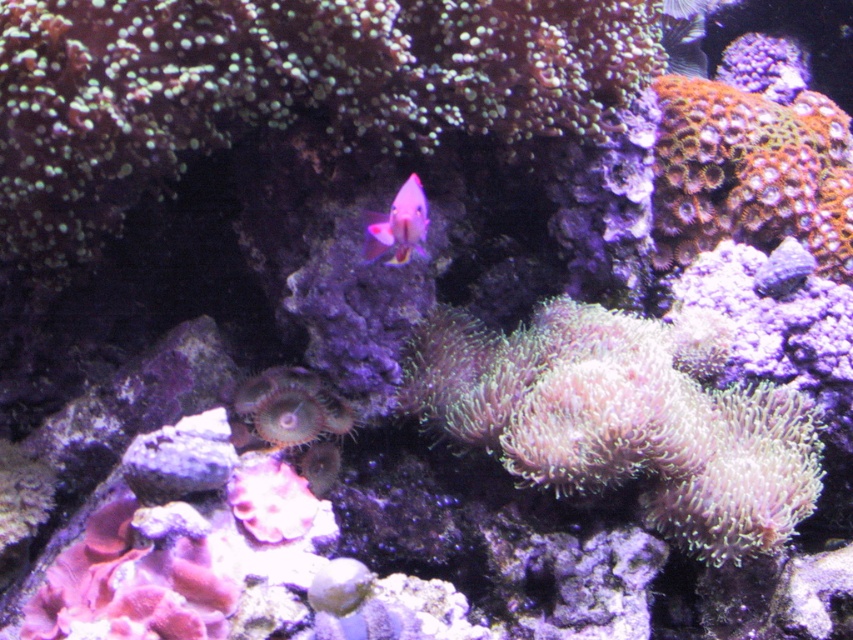
Question: Does green translucent coral at center appear under pink glossy fish at center?

Choices:
 (A) no
 (B) yes

Answer: (B)

Question: Is green translucent coral at center wider than purple coral at center?

Choices:
 (A) no
 (B) yes

Answer: (B)

Question: Estimate the real-world distances between objects in this image. Which object is closer to the green translucent coral at center?

Choices:
 (A) purple coral at center
 (B) pink glossy fish at center

Answer: (B)

Question: Which object is the farthest from the green translucent coral at center?

Choices:
 (A) purple coral at center
 (B) pink glossy fish at center

Answer: (A)

Question: Observing the image, what is the correct spatial positioning of green translucent coral at center in reference to pink glossy fish at center?

Choices:
 (A) right
 (B) left

Answer: (B)

Question: Which of the following is the closest to the observer?

Choices:
 (A) pink glossy fish at center
 (B) purple coral at center
 (C) green translucent coral at center

Answer: (A)